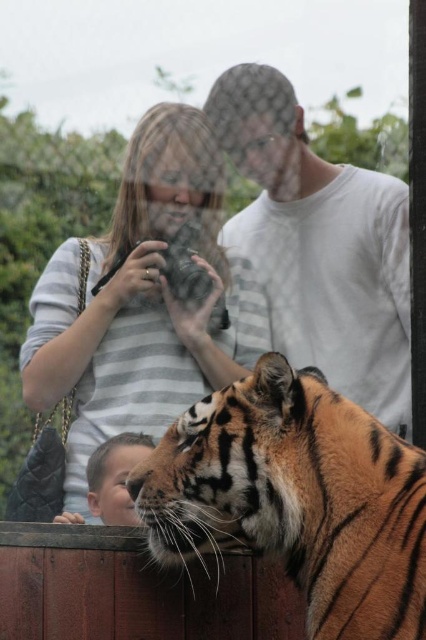
Question: Which of the following is the closest to the observer?

Choices:
 (A) (363, 564)
 (B) (258, 68)

Answer: (A)

Question: Estimate the real-world distances between objects in this image. Which object is closer to the smooth skin face at lower left?

Choices:
 (A) white cotton shirt at upper center
 (B) orange striped fur tiger at center

Answer: (A)

Question: Is the position of orange striped fur tiger at center more distant than that of smooth skin face at lower left?

Choices:
 (A) yes
 (B) no

Answer: (B)

Question: Can you confirm if white cotton shirt at upper center is thinner than smooth skin face at lower left?

Choices:
 (A) yes
 (B) no

Answer: (B)

Question: Which is farther from the white cotton shirt at upper center?

Choices:
 (A) orange striped fur tiger at center
 (B) striped fabric shirt at upper center

Answer: (A)

Question: Does white cotton shirt at upper center appear on the right side of smooth skin face at lower left?

Choices:
 (A) no
 (B) yes

Answer: (B)